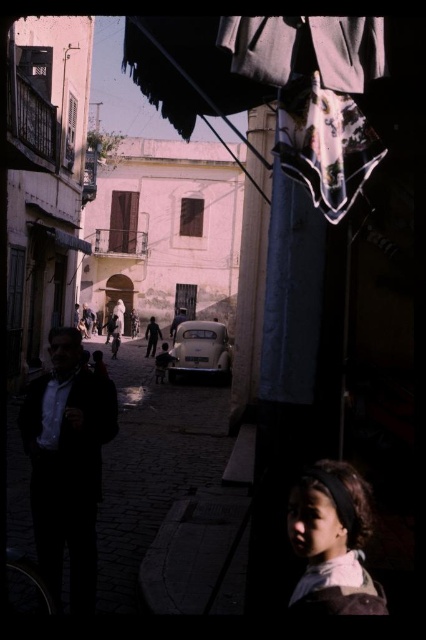
Is point (195, 384) positioned behind point (203, 371)?

Yes, point (195, 384) is behind point (203, 371).

Is point (210, 483) closer to camera compared to point (198, 368)?

That is True.

Between point (141, 548) and point (215, 339), which one is positioned in front?

Point (141, 548) is more forward.

You are a GUI agent. You are given a task and a screenshot of the screen. Output one action in this format:
    pyautogui.click(x=<x>, y=<y>)
    Task: Click on the white matte car at center
    This screenshot has height=640, width=426.
    Given the screenshot: What is the action you would take?
    pyautogui.click(x=152, y=465)

Is dark matte suit at left to the left of dark brown hair at lower right from the viewer's perspective?

Indeed, dark matte suit at left is positioned on the left side of dark brown hair at lower right.

Does dark matte suit at left appear on the right side of dark brown hair at lower right?

In fact, dark matte suit at left is to the left of dark brown hair at lower right.

Who is more forward, (36, 388) or (365, 508)?

Point (365, 508) is in front.

Find the location of a particular element. dark matte suit at left is located at coordinates click(68, 464).

I want to click on white matte car at center, so click(x=152, y=465).

Can you confirm if white matte car at center is thinner than dark brown hair at center?

Incorrect, white matte car at center's width is not less than dark brown hair at center's.

Identify the location of white matte car at center. This screenshot has height=640, width=426. (152, 465).